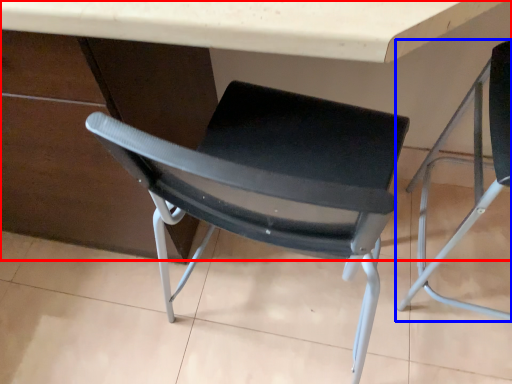
Question: Among these objects, which one is nearest to the camera, table (highlighted by a red box) or chair (highlighted by a blue box)?

Choices:
 (A) table
 (B) chair

Answer: (A)